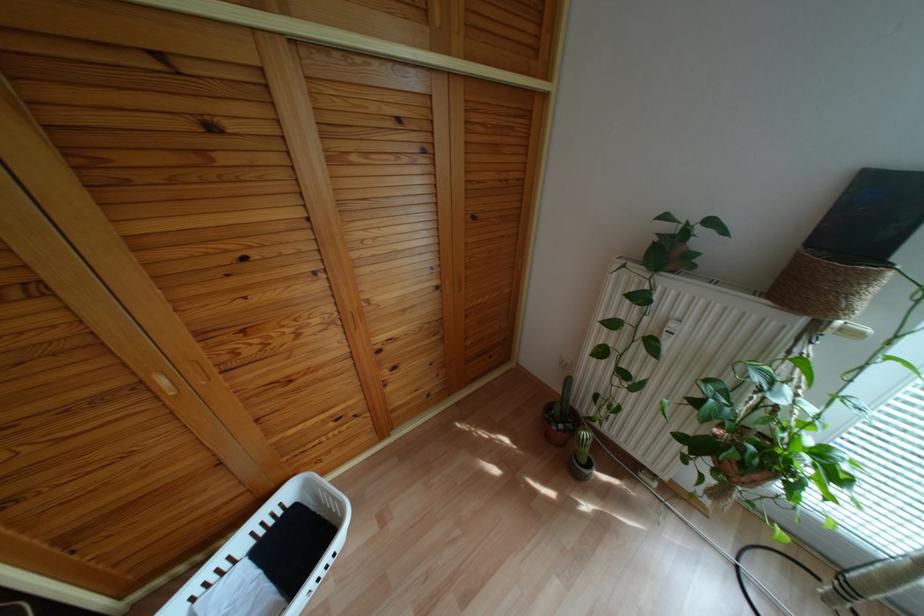
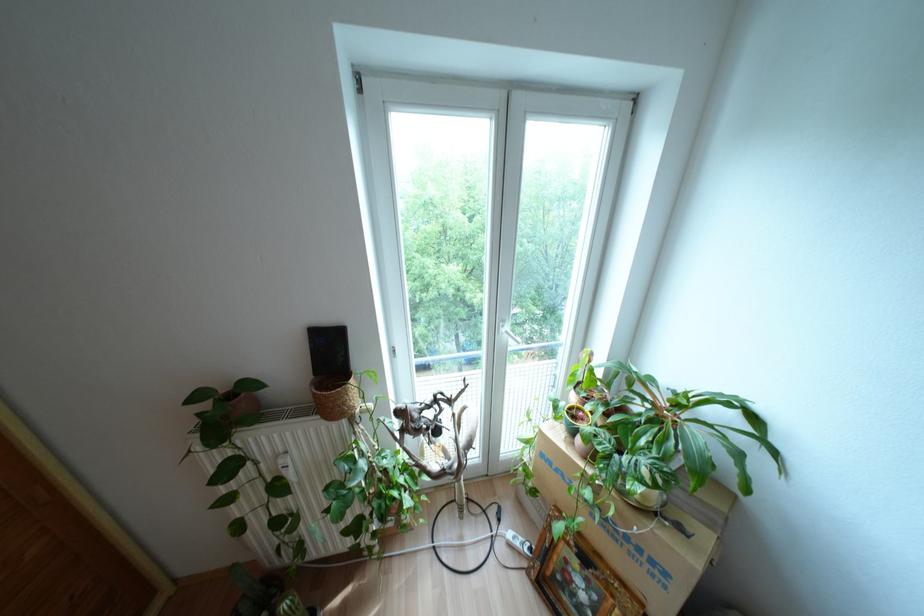
Question: The images are taken continuously from a first-person perspective. In which direction is your viewpoint rotating?

Choices:
 (A) Left
 (B) Right
 (C) Up
 (D) Down

Answer: (B)